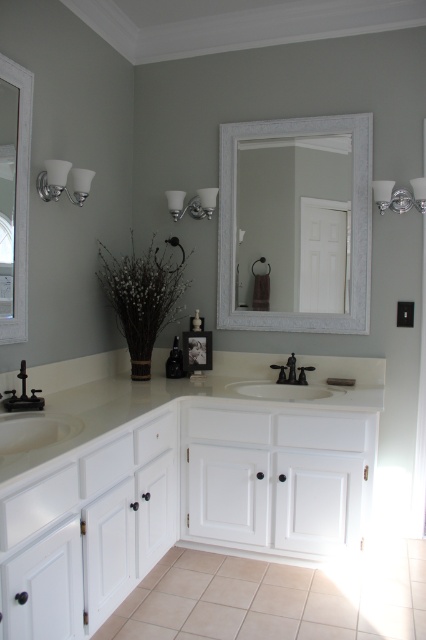
Question: Can you confirm if white glossy countertop at center is smaller than polished bronze faucet at center?

Choices:
 (A) no
 (B) yes

Answer: (A)

Question: Which object appears closest to the camera in this image?

Choices:
 (A) white glossy countertop at center
 (B) black matte faucet at lower left
 (C) silver textured mirror at center

Answer: (A)

Question: Considering the real-world distances, which object is farthest from the silver textured mirror at center?

Choices:
 (A) polished bronze faucet at center
 (B) matte black faucet at center

Answer: (A)

Question: Which of the following is the farthest from the observer?

Choices:
 (A) (218, 262)
 (B) (293, 381)
 (C) (284, 376)
 (D) (13, 392)

Answer: (A)

Question: Can you confirm if white glossy countertop at center is positioned to the right of silver textured mirror at center?

Choices:
 (A) no
 (B) yes

Answer: (A)

Question: Observing the image, what is the correct spatial positioning of silver textured mirror at center in reference to matte black faucet at center?

Choices:
 (A) right
 (B) left

Answer: (A)